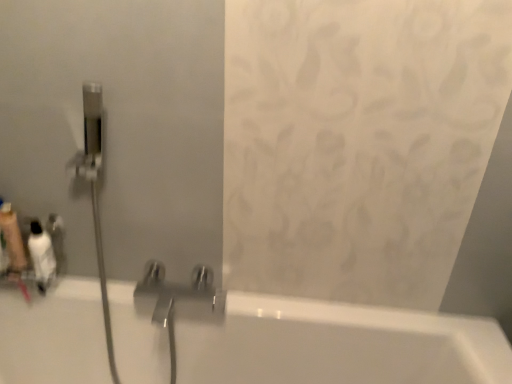
What are the coordinates of `white glossy bottle at left, the second toiletry when ordered from left to right` in the screenshot? It's located at (41, 255).

This screenshot has height=384, width=512. What do you see at coordinates (41, 255) in the screenshot? I see `white glossy bottle at left, the second toiletry when ordered from left to right` at bounding box center [41, 255].

Identify the location of translucent plastic soap dispenser at left, arranged as the 1th toiletry when viewed from the left. (12, 238).

This screenshot has height=384, width=512. What do you see at coordinates (12, 238) in the screenshot?
I see `translucent plastic soap dispenser at left, arranged as the 1th toiletry when viewed from the left` at bounding box center [12, 238].

Image resolution: width=512 pixels, height=384 pixels. Identify the location of white glossy bottle at left, marked as the 1th toiletry in a right-to-left arrangement. (41, 255).

Based on the photo, can you confirm if white glossy bottle at left, marked as the 1th toiletry in a right-to-left arrangement, is positioned to the left of translucent plastic soap dispenser at left, arranged as the 1th toiletry when viewed from the left?

In fact, white glossy bottle at left, marked as the 1th toiletry in a right-to-left arrangement, is to the right of translucent plastic soap dispenser at left, arranged as the 1th toiletry when viewed from the left.

From the picture: Is the position of white glossy bottle at left, the second toiletry when ordered from left to right, less distant than that of translucent plastic soap dispenser at left, arranged as the 1th toiletry when viewed from the left?

Yes.

Does point (52, 271) lie in front of point (9, 253)?

Yes.

From the image's perspective, which is above, white glossy bottle at left, the second toiletry when ordered from left to right, or translucent plastic soap dispenser at left, arranged as the 2th toiletry when viewed from the right?

translucent plastic soap dispenser at left, arranged as the 2th toiletry when viewed from the right.

From a real-world perspective, which object rests below the other?

white glossy bottle at left, marked as the 1th toiletry in a right-to-left arrangement, from a real-world perspective.

Is white glossy bottle at left, the second toiletry when ordered from left to right, wider or thinner than translucent plastic soap dispenser at left, arranged as the 2th toiletry when viewed from the right?

In the image, white glossy bottle at left, the second toiletry when ordered from left to right, appears to be wider than translucent plastic soap dispenser at left, arranged as the 2th toiletry when viewed from the right.

Who is taller, white glossy bottle at left, the second toiletry when ordered from left to right, or translucent plastic soap dispenser at left, arranged as the 1th toiletry when viewed from the left?

translucent plastic soap dispenser at left, arranged as the 1th toiletry when viewed from the left.

Does white glossy bottle at left, marked as the 1th toiletry in a right-to-left arrangement, have a smaller size compared to translucent plastic soap dispenser at left, arranged as the 1th toiletry when viewed from the left?

No, white glossy bottle at left, marked as the 1th toiletry in a right-to-left arrangement, is not smaller than translucent plastic soap dispenser at left, arranged as the 1th toiletry when viewed from the left.

Would you say white glossy bottle at left, marked as the 1th toiletry in a right-to-left arrangement, contains translucent plastic soap dispenser at left, arranged as the 1th toiletry when viewed from the left?

No, translucent plastic soap dispenser at left, arranged as the 1th toiletry when viewed from the left, is located outside of white glossy bottle at left, marked as the 1th toiletry in a right-to-left arrangement.

Is white glossy bottle at left, the second toiletry when ordered from left to right, not close to translucent plastic soap dispenser at left, arranged as the 1th toiletry when viewed from the left?

white glossy bottle at left, the second toiletry when ordered from left to right, is near translucent plastic soap dispenser at left, arranged as the 1th toiletry when viewed from the left, not far away.

Is white glossy bottle at left, the second toiletry when ordered from left to right, oriented away from translucent plastic soap dispenser at left, arranged as the 2th toiletry when viewed from the right?

white glossy bottle at left, the second toiletry when ordered from left to right, is not turned away from translucent plastic soap dispenser at left, arranged as the 2th toiletry when viewed from the right.

How many degrees apart are the facing directions of white glossy bottle at left, the second toiletry when ordered from left to right, and translucent plastic soap dispenser at left, arranged as the 1th toiletry when viewed from the left?

white glossy bottle at left, the second toiletry when ordered from left to right, and translucent plastic soap dispenser at left, arranged as the 1th toiletry when viewed from the left, are facing 0.000182 degrees away from each other.

How far apart are white glossy bottle at left, marked as the 1th toiletry in a right-to-left arrangement, and translucent plastic soap dispenser at left, arranged as the 1th toiletry when viewed from the left?

The distance of white glossy bottle at left, marked as the 1th toiletry in a right-to-left arrangement, from translucent plastic soap dispenser at left, arranged as the 1th toiletry when viewed from the left, is 7.02 centimeters.

Where is `toiletry lying behind the white glossy bottle at left, the second toiletry when ordered from left to right`? toiletry lying behind the white glossy bottle at left, the second toiletry when ordered from left to right is located at coordinates (12, 238).

Considering the relative positions of translucent plastic soap dispenser at left, arranged as the 1th toiletry when viewed from the left, and white glossy bottle at left, marked as the 1th toiletry in a right-to-left arrangement, in the image provided, is translucent plastic soap dispenser at left, arranged as the 1th toiletry when viewed from the left, to the left or to the right of white glossy bottle at left, marked as the 1th toiletry in a right-to-left arrangement,?

translucent plastic soap dispenser at left, arranged as the 1th toiletry when viewed from the left, is positioned on white glossy bottle at left, marked as the 1th toiletry in a right-to-left arrangement,'s left side.

In the image, is translucent plastic soap dispenser at left, arranged as the 1th toiletry when viewed from the left, positioned in front of or behind white glossy bottle at left, marked as the 1th toiletry in a right-to-left arrangement?

In the image, translucent plastic soap dispenser at left, arranged as the 1th toiletry when viewed from the left, appears behind white glossy bottle at left, marked as the 1th toiletry in a right-to-left arrangement.

Is point (10, 218) closer or farther from the camera than point (34, 246)?

Point (10, 218) is farther from the camera than point (34, 246).

From the image's perspective, is translucent plastic soap dispenser at left, arranged as the 2th toiletry when viewed from the right, located above or below white glossy bottle at left, the second toiletry when ordered from left to right?

translucent plastic soap dispenser at left, arranged as the 2th toiletry when viewed from the right, is above white glossy bottle at left, the second toiletry when ordered from left to right.

From a real-world perspective, is translucent plastic soap dispenser at left, arranged as the 1th toiletry when viewed from the left, over white glossy bottle at left, the second toiletry when ordered from left to right?

Yes, from a real-world perspective, translucent plastic soap dispenser at left, arranged as the 1th toiletry when viewed from the left, is on top of white glossy bottle at left, the second toiletry when ordered from left to right.

Which object is wider, translucent plastic soap dispenser at left, arranged as the 2th toiletry when viewed from the right, or white glossy bottle at left, marked as the 1th toiletry in a right-to-left arrangement?

With larger width is white glossy bottle at left, marked as the 1th toiletry in a right-to-left arrangement.

Considering the relative sizes of translucent plastic soap dispenser at left, arranged as the 1th toiletry when viewed from the left, and white glossy bottle at left, marked as the 1th toiletry in a right-to-left arrangement, in the image provided, is translucent plastic soap dispenser at left, arranged as the 1th toiletry when viewed from the left, taller than white glossy bottle at left, marked as the 1th toiletry in a right-to-left arrangement,?

Indeed, translucent plastic soap dispenser at left, arranged as the 1th toiletry when viewed from the left, has a greater height compared to white glossy bottle at left, marked as the 1th toiletry in a right-to-left arrangement.

Who is bigger, translucent plastic soap dispenser at left, arranged as the 1th toiletry when viewed from the left, or white glossy bottle at left, marked as the 1th toiletry in a right-to-left arrangement?

white glossy bottle at left, marked as the 1th toiletry in a right-to-left arrangement.

Could white glossy bottle at left, marked as the 1th toiletry in a right-to-left arrangement, be considered to be inside translucent plastic soap dispenser at left, arranged as the 2th toiletry when viewed from the right?

No, translucent plastic soap dispenser at left, arranged as the 2th toiletry when viewed from the right, does not contain white glossy bottle at left, marked as the 1th toiletry in a right-to-left arrangement.

Are translucent plastic soap dispenser at left, arranged as the 2th toiletry when viewed from the right, and white glossy bottle at left, marked as the 1th toiletry in a right-to-left arrangement, far apart?

No, translucent plastic soap dispenser at left, arranged as the 2th toiletry when viewed from the right, is not far from white glossy bottle at left, marked as the 1th toiletry in a right-to-left arrangement.

Does translucent plastic soap dispenser at left, arranged as the 1th toiletry when viewed from the left, turn towards white glossy bottle at left, marked as the 1th toiletry in a right-to-left arrangement?

No, translucent plastic soap dispenser at left, arranged as the 1th toiletry when viewed from the left, is not turned towards white glossy bottle at left, marked as the 1th toiletry in a right-to-left arrangement.

You are a GUI agent. You are given a task and a screenshot of the screen. Output one action in this format:
    pyautogui.click(x=<x>, y=<y>)
    Task: Click on the toiletry positioned vertically above the white glossy bottle at left, marked as the 1th toiletry in a right-to-left arrangement (from a real-world perspective)
    
    Given the screenshot: What is the action you would take?
    pyautogui.click(x=12, y=238)

Where is `toiletry on the left side of white glossy bottle at left, marked as the 1th toiletry in a right-to-left arrangement`? toiletry on the left side of white glossy bottle at left, marked as the 1th toiletry in a right-to-left arrangement is located at coordinates (12, 238).

Where is `toiletry located on the right of translucent plastic soap dispenser at left, arranged as the 1th toiletry when viewed from the left`? toiletry located on the right of translucent plastic soap dispenser at left, arranged as the 1th toiletry when viewed from the left is located at coordinates (41, 255).